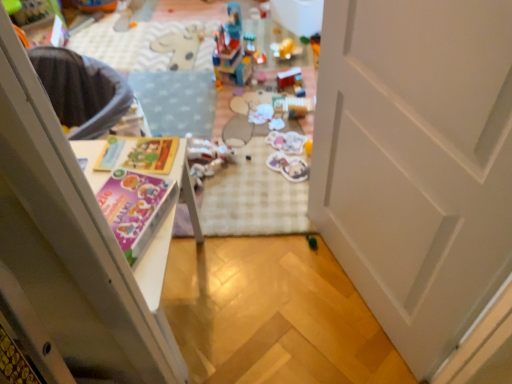
You are a GUI agent. You are given a task and a screenshot of the screen. Output one action in this format:
    pyautogui.click(x=<x>, y=<y>)
    Task: Click on the vacant space that is in between translucent plastic stickers at center, the 4th toy from the bottom, and brick-like plastic toy at center, which appears as the first toy when viewed from the top
    The image size is (512, 384).
    Given the screenshot: What is the action you would take?
    pyautogui.click(x=257, y=107)